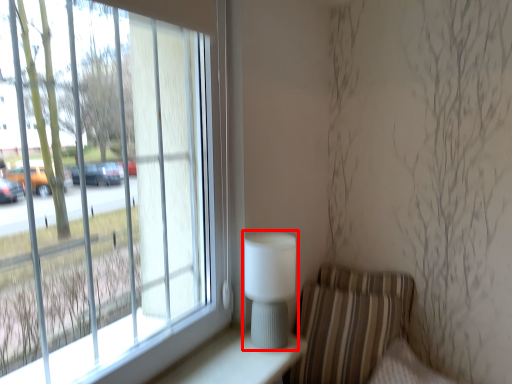
Question: Considering the relative positions of table lamp (annotated by the red box) and armchair in the image provided, where is table lamp (annotated by the red box) located with respect to the staircase?

Choices:
 (A) right
 (B) left

Answer: (B)